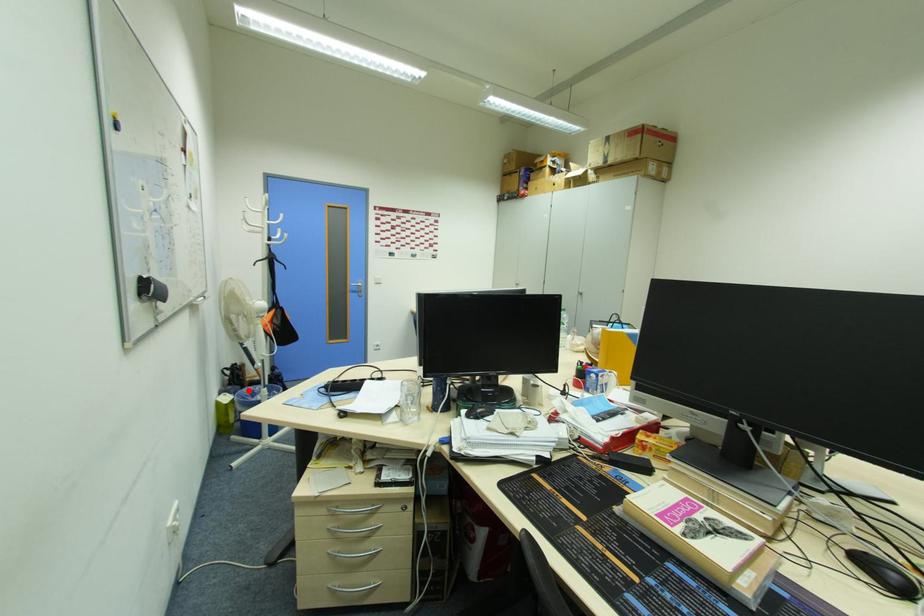
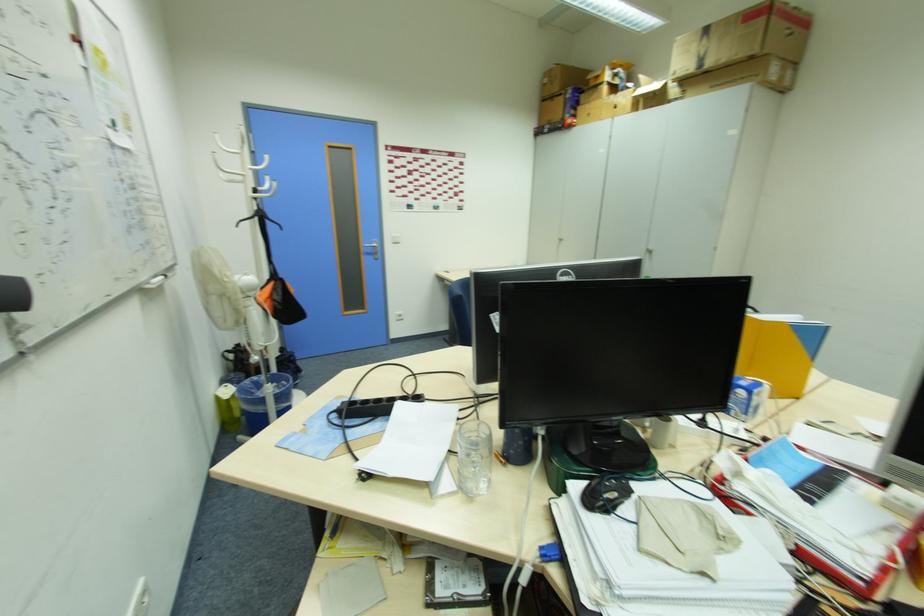
Where in the second image is the point corresponding to the highlighted location from the first image?

(249, 383)